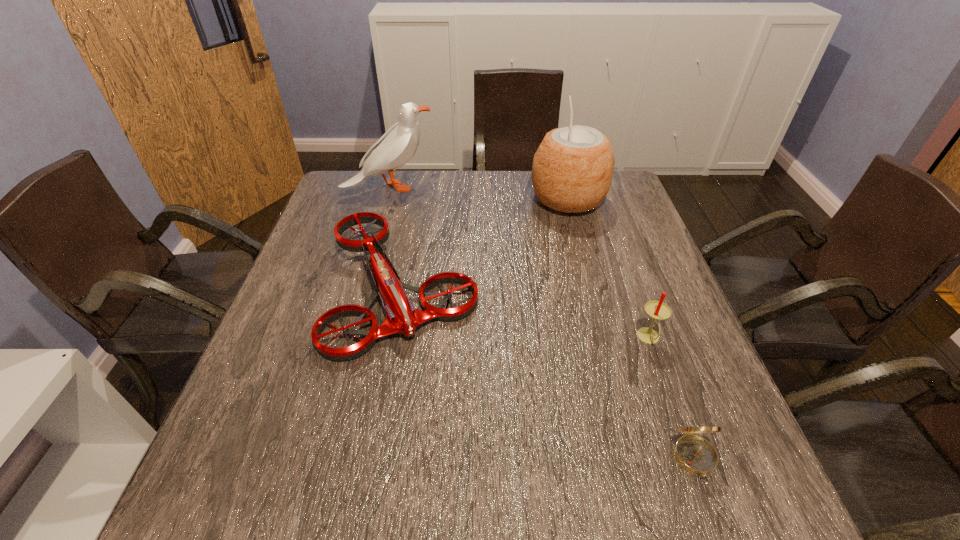
Locate an element on the screen. object situated at the near right corner is located at coordinates (696, 455).

In the image, there is a desktop. At what (x,y) coordinates should I click in order to perform the action: click on blank space at the far edge. Please return your answer as a coordinate pair (x, y). The image size is (960, 540). Looking at the image, I should click on (406, 211).

Where is `free space at the near edge of the desktop`? Image resolution: width=960 pixels, height=540 pixels. free space at the near edge of the desktop is located at coordinates (609, 500).

Locate an element on the screen. Image resolution: width=960 pixels, height=540 pixels. blank area at the left edge is located at coordinates (292, 298).

In the image, there is a desktop. Identify the location of free space at the right edge. (660, 451).

Image resolution: width=960 pixels, height=540 pixels. What are the coordinates of `vacant space at the far left corner` in the screenshot? It's located at (338, 184).

Identify the location of free space at the near left corner of the desktop. (252, 475).

Where is `free location at the far right corner of the desktop`? free location at the far right corner of the desktop is located at coordinates (618, 210).

I want to click on vacant area between the candle and the gull, so click(x=519, y=263).

Where is `free space between the drone and the gull`? free space between the drone and the gull is located at coordinates (396, 238).